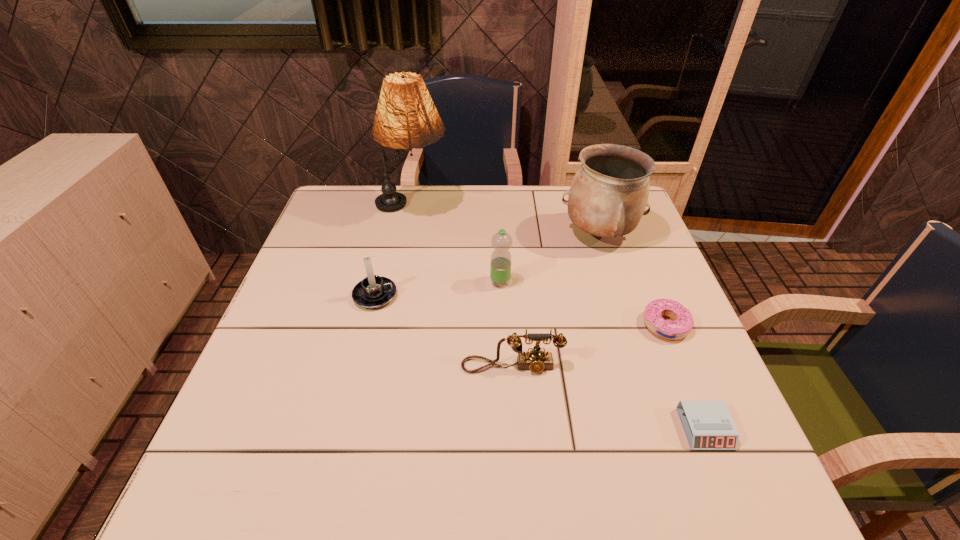
Locate an element on the screen. This screenshot has height=540, width=960. blank area located 0.340m on the front of the urn is located at coordinates (637, 355).

Where is `free space located 0.370m on the left of the water bottle`? The width and height of the screenshot is (960, 540). free space located 0.370m on the left of the water bottle is located at coordinates (348, 282).

Identify the location of vacant space located 0.090m with a handle on the side of the candle holder. (433, 295).

Identify the location of free region located on the front-facing side of the second nearest object. (517, 458).

Where is `vacant area located 0.070m on the back of the doughnut`? Image resolution: width=960 pixels, height=540 pixels. vacant area located 0.070m on the back of the doughnut is located at coordinates click(650, 288).

At what (x,y) coordinates should I click in order to perform the action: click on free region located on the left of the nearest object. Please return your answer as a coordinate pair (x, y). This screenshot has height=540, width=960. Looking at the image, I should click on (481, 429).

Locate an element on the screen. The width and height of the screenshot is (960, 540). lampshade at the far edge is located at coordinates (406, 117).

Identify the location of urn located in the far edge section of the desktop. Image resolution: width=960 pixels, height=540 pixels. (609, 193).

Identify the location of object that is at the left edge. (406, 117).

Where is `urn at the right edge`? This screenshot has width=960, height=540. urn at the right edge is located at coordinates (609, 193).